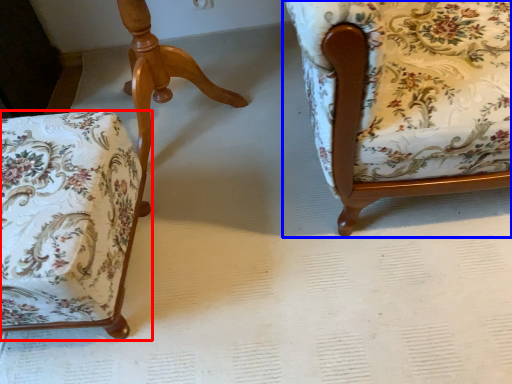
Question: Which object is closer to the camera taking this photo, chair (highlighted by a red box) or chair (highlighted by a blue box)?

Choices:
 (A) chair
 (B) chair

Answer: (B)